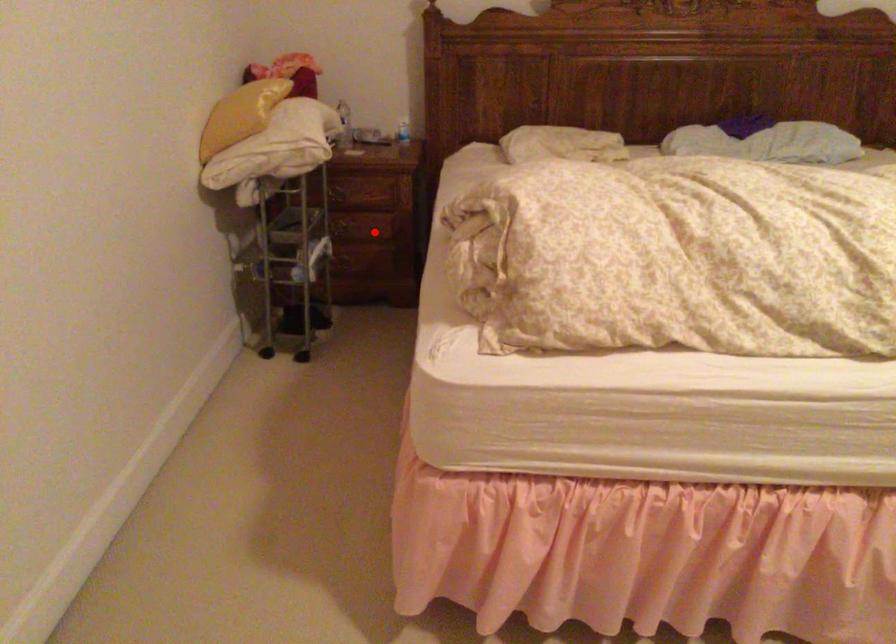
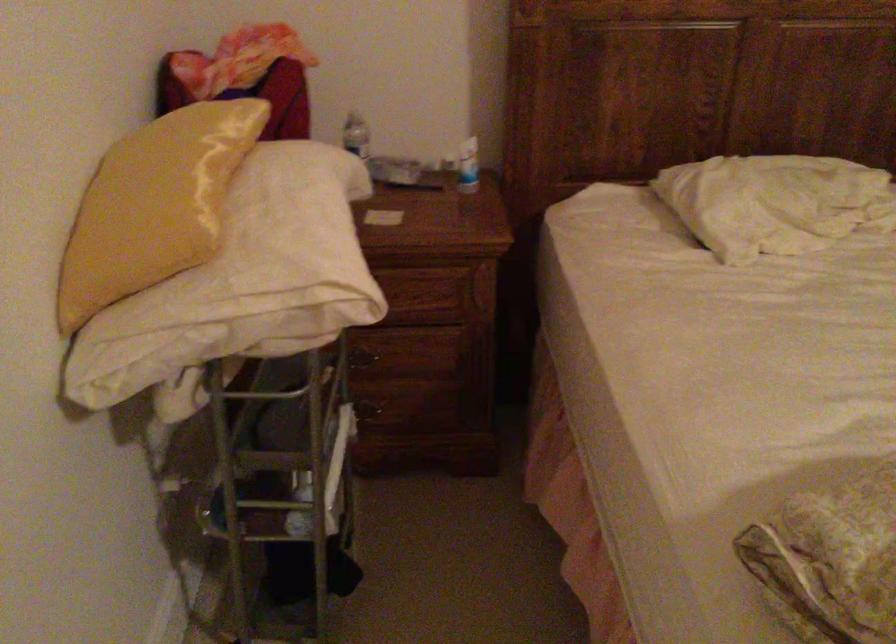
Question: I am providing you with two images of the same scene from different viewpoints. In image1, a red point is highlighted. Considering the same 3D point in image2, which of the following is correct?

Choices:
 (A) It is closer
 (B) It is farther

Answer: (A)